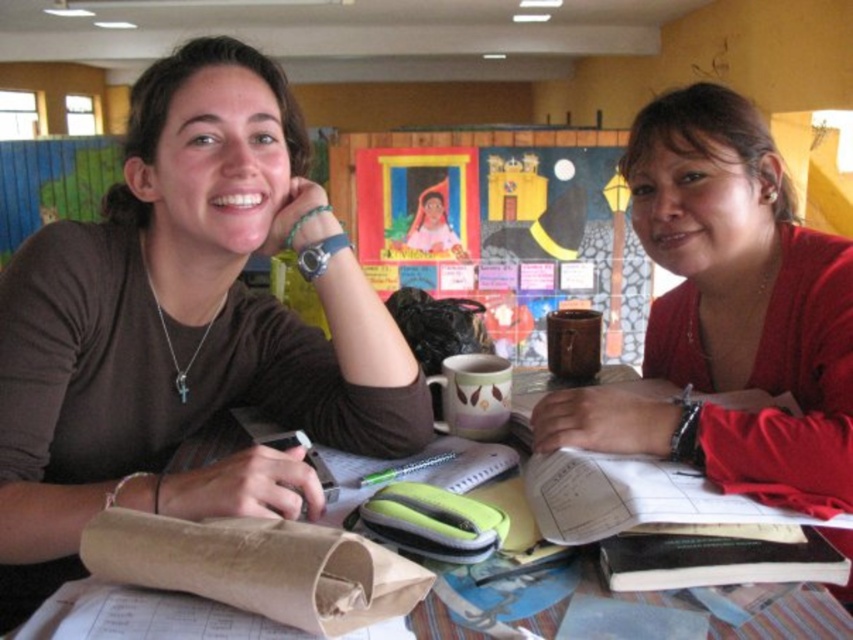
Question: Is matte red sweater at center thinner than brown paper bag at lower left?

Choices:
 (A) yes
 (B) no

Answer: (A)

Question: Which point is closer to the camera taking this photo?

Choices:
 (A) pos(369,179)
 (B) pos(195,276)

Answer: (B)

Question: Which object is positioned farthest from the painted cardboard bulletin board at center?

Choices:
 (A) matte red sweater at center
 (B) brown/kraft paper bag at center

Answer: (B)

Question: Is the position of brown/kraft paper bag at center more distant than that of brown paper bag at lower left?

Choices:
 (A) yes
 (B) no

Answer: (B)

Question: Is matte red sweater at center thinner than brown paper bag at lower left?

Choices:
 (A) yes
 (B) no

Answer: (A)

Question: Which object appears farthest from the camera in this image?

Choices:
 (A) brown matte shirt at center
 (B) brown paper bag at lower left
 (C) painted cardboard bulletin board at center

Answer: (C)